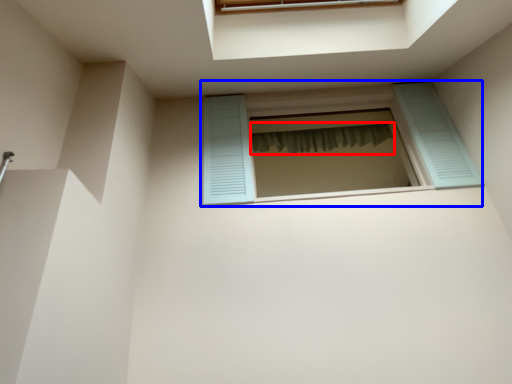
Question: Which of the following is the farthest to the observer, shower curtain (highlighted by a red box) or window (highlighted by a blue box)?

Choices:
 (A) shower curtain
 (B) window

Answer: (A)